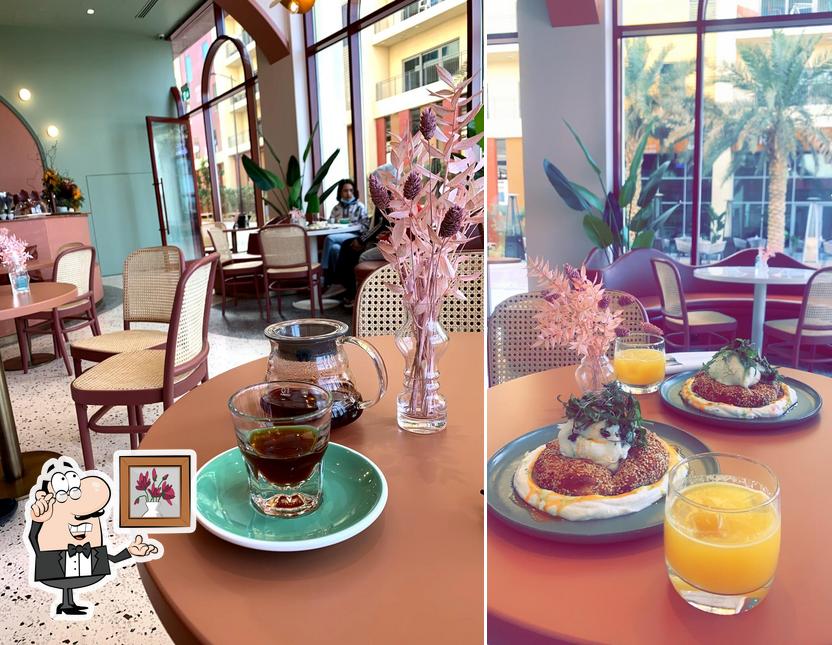
This screenshot has height=645, width=832. Find the location of `cup`. cup is located at coordinates (279, 453), (310, 353), (642, 362), (729, 526).